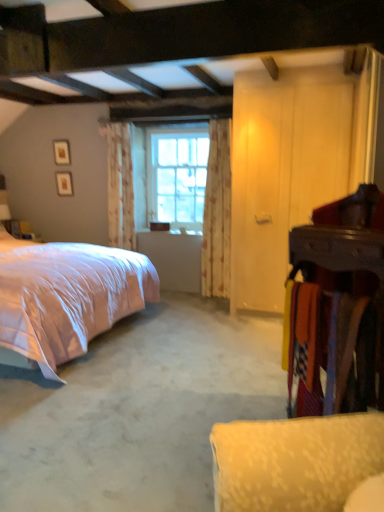
Question: Considering the relative sizes of floral fabric curtain at center, acting as the 2th curtain starting from the right, and wooden armoire at right in the image provided, is floral fabric curtain at center, acting as the 2th curtain starting from the right, bigger than wooden armoire at right?

Choices:
 (A) no
 (B) yes

Answer: (B)

Question: Considering the relative positions of floral fabric curtain at center, which is counted as the 1th curtain, starting from the left, and wooden armoire at right in the image provided, is floral fabric curtain at center, which is counted as the 1th curtain, starting from the left, to the left of wooden armoire at right from the viewer's perspective?

Choices:
 (A) yes
 (B) no

Answer: (A)

Question: Is floral fabric curtain at center, which is counted as the 1th curtain, starting from the left, smaller than wooden armoire at right?

Choices:
 (A) yes
 (B) no

Answer: (B)

Question: From a real-world perspective, does floral fabric curtain at center, acting as the 2th curtain starting from the right, sit lower than wooden armoire at right?

Choices:
 (A) yes
 (B) no

Answer: (B)

Question: Does floral fabric curtain at center, which is counted as the 1th curtain, starting from the left, come behind wooden armoire at right?

Choices:
 (A) yes
 (B) no

Answer: (A)

Question: Is pink satin bed at left to the left or to the right of clear glass window at center in the image?

Choices:
 (A) left
 (B) right

Answer: (A)

Question: Based on their sizes in the image, would you say pink satin bed at left is bigger or smaller than clear glass window at center?

Choices:
 (A) big
 (B) small

Answer: (A)

Question: Considering their positions, is pink satin bed at left located in front of or behind clear glass window at center?

Choices:
 (A) front
 (B) behind

Answer: (A)

Question: Considering the positions of point (105, 269) and point (172, 175), is point (105, 269) closer or farther from the camera than point (172, 175)?

Choices:
 (A) farther
 (B) closer

Answer: (B)

Question: Is floral fabric curtain at center, arranged as the first curtain when viewed from the right, wider or thinner than pink satin bed at left?

Choices:
 (A) wide
 (B) thin

Answer: (B)

Question: Does point (211, 140) appear closer or farther from the camera than point (29, 259)?

Choices:
 (A) farther
 (B) closer

Answer: (A)

Question: Based on their positions, is floral fabric curtain at center, placed as the 2th curtain when sorted from left to right, located to the left or right of pink satin bed at left?

Choices:
 (A) left
 (B) right

Answer: (B)

Question: From their relative heights in the image, would you say floral fabric curtain at center, arranged as the first curtain when viewed from the right, is taller or shorter than pink satin bed at left?

Choices:
 (A) short
 (B) tall

Answer: (B)

Question: Visually, is clear glass window at center positioned to the left or to the right of floral fabric curtain at center, which is counted as the 1th curtain, starting from the left?

Choices:
 (A) right
 (B) left

Answer: (A)

Question: From a real-world perspective, is clear glass window at center above or below floral fabric curtain at center, which is counted as the 1th curtain, starting from the left?

Choices:
 (A) above
 (B) below

Answer: (A)